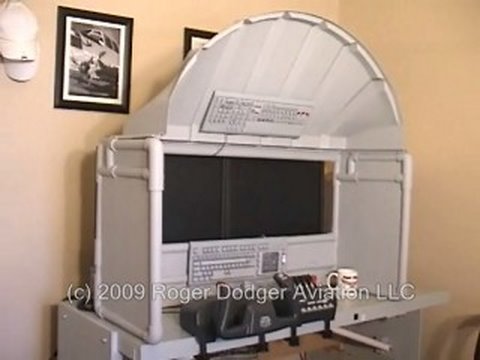
Identify the location of two monitors on wall of desk. (188, 191), (279, 192).